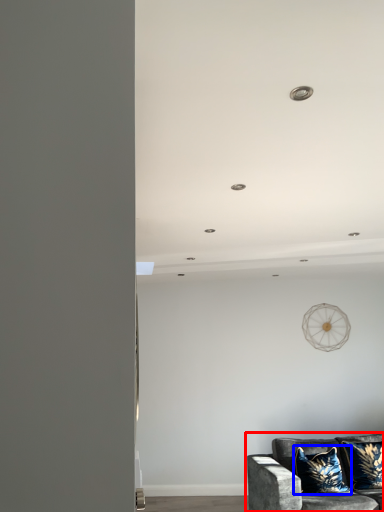
Question: Which object appears farthest to the camera in this image, studio couch (highlighted by a red box) or pillow (highlighted by a blue box)?

Choices:
 (A) studio couch
 (B) pillow

Answer: (B)